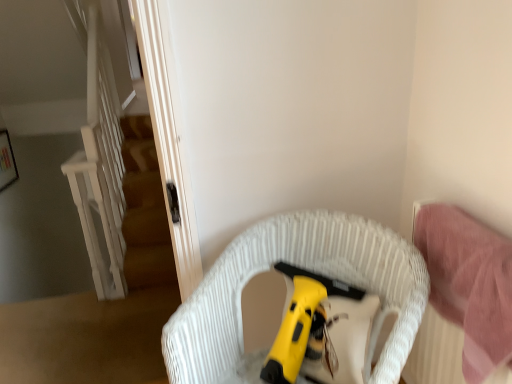
You are a GUI agent. You are given a task and a screenshot of the screen. Output one action in this format:
    pyautogui.click(x=<x>, y=<y>)
    Task: Click on the yellow plastic vacuum cleaner at center
    The image size is (512, 384).
    Given the screenshot: What is the action you would take?
    pyautogui.click(x=305, y=325)

You are a GUI agent. You are given a task and a screenshot of the screen. Output one action in this format:
    pyautogui.click(x=<x>, y=<y>)
    Task: Click on the pink fabric bed at right
    Image resolution: width=512 pixels, height=384 pixels.
    Given the screenshot: What is the action you would take?
    pyautogui.click(x=434, y=353)

At what (x,y) coordinates should I click in order to perform the action: click on white woven chair at center. Please return your answer as a coordinate pair (x, y). The width and height of the screenshot is (512, 384). Looking at the image, I should click on (306, 269).

Are white woven chair at center and yellow plastic vacuum cleaner at center far apart?

That's not correct — white woven chair at center is a little close to yellow plastic vacuum cleaner at center.

Who is more distant, white woven chair at center or yellow plastic vacuum cleaner at center?

Positioned behind is yellow plastic vacuum cleaner at center.

How far apart are white woven chair at center and yellow plastic vacuum cleaner at center?

white woven chair at center is 5.45 inches away from yellow plastic vacuum cleaner at center.

Based on the photo, is yellow plastic vacuum cleaner at center located within white woven chair at center?

Yes, yellow plastic vacuum cleaner at center is a part of white woven chair at center.

Does yellow plastic vacuum cleaner at center have a smaller size compared to pink fabric bed at right?

Yes, yellow plastic vacuum cleaner at center is smaller than pink fabric bed at right.

Is point (312, 348) positioned behind point (449, 348)?

Yes, point (312, 348) is behind point (449, 348).

From a real-world perspective, which is physically above, yellow plastic vacuum cleaner at center or pink fabric bed at right?

In real-world perspective, pink fabric bed at right is above.

From a real-world perspective, is pink fabric bed at right on yellow plastic vacuum cleaner at center?

Correct, in the physical world, pink fabric bed at right is higher than yellow plastic vacuum cleaner at center.

From the image's perspective, would you say pink fabric bed at right is positioned over yellow plastic vacuum cleaner at center?

Yes, from the image's perspective, pink fabric bed at right is on top of yellow plastic vacuum cleaner at center.

Is the depth of pink fabric bed at right less than that of yellow plastic vacuum cleaner at center?

That is True.

Would you consider white woven chair at center to be distant from pink fabric bed at right?

No, white woven chair at center is not far away from pink fabric bed at right.

Considering the positions of objects white woven chair at center and pink fabric bed at right in the image provided, who is behind, white woven chair at center or pink fabric bed at right?

pink fabric bed at right is more distant.

Is white woven chair at center outside of pink fabric bed at right?

white woven chair at center lies outside pink fabric bed at right's area.

Which is more to the right, pink fabric bed at right or white woven chair at center?

pink fabric bed at right is more to the right.

Is pink fabric bed at right facing away from white woven chair at center?

That's not correct — pink fabric bed at right is not looking away from white woven chair at center.

Does pink fabric bed at right have a larger size compared to white woven chair at center?

Incorrect, pink fabric bed at right is not larger than white woven chair at center.

Which of these two, yellow plastic vacuum cleaner at center or white woven chair at center, stands shorter?

yellow plastic vacuum cleaner at center is shorter.

Find the location of a particular element. furniture beneath the yellow plastic vacuum cleaner at center (from a real-world perspective) is located at coordinates (306, 269).

Could white woven chair at center be considered to be inside yellow plastic vacuum cleaner at center?

No, white woven chair at center is not a part of yellow plastic vacuum cleaner at center.

Consider the image. How far apart are yellow plastic vacuum cleaner at center and white woven chair at center?

The distance of yellow plastic vacuum cleaner at center from white woven chair at center is 5.45 inches.

Where is `furniture directly beneath the yellow plastic vacuum cleaner at center (from a real-world perspective)`? This screenshot has height=384, width=512. furniture directly beneath the yellow plastic vacuum cleaner at center (from a real-world perspective) is located at coordinates (306, 269).

Image resolution: width=512 pixels, height=384 pixels. I want to click on bed that appears on the right of yellow plastic vacuum cleaner at center, so click(434, 353).

When comparing their distances from white woven chair at center, does yellow plastic vacuum cleaner at center or pink fabric bed at right seem closer?

Based on the image, yellow plastic vacuum cleaner at center appears to be nearer to white woven chair at center.

Looking at this image, when comparing their distances from pink fabric bed at right, does yellow plastic vacuum cleaner at center or white woven chair at center seem closer?

yellow plastic vacuum cleaner at center.

From the image, which object appears to be farther from pink fabric bed at right, white woven chair at center or yellow plastic vacuum cleaner at center?

white woven chair at center is further to pink fabric bed at right.

Based on their spatial positions, is white woven chair at center or pink fabric bed at right closer to yellow plastic vacuum cleaner at center?

The object closer to yellow plastic vacuum cleaner at center is white woven chair at center.

From the image, which object appears to be farther from white woven chair at center, pink fabric bed at right or yellow plastic vacuum cleaner at center?

pink fabric bed at right.

Looking at the image, which one is located closer to yellow plastic vacuum cleaner at center, pink fabric bed at right or white woven chair at center?

white woven chair at center is positioned closer to the anchor yellow plastic vacuum cleaner at center.

This screenshot has height=384, width=512. Find the location of `toy between white woven chair at center and pink fabric bed at right`. toy between white woven chair at center and pink fabric bed at right is located at coordinates (305, 325).